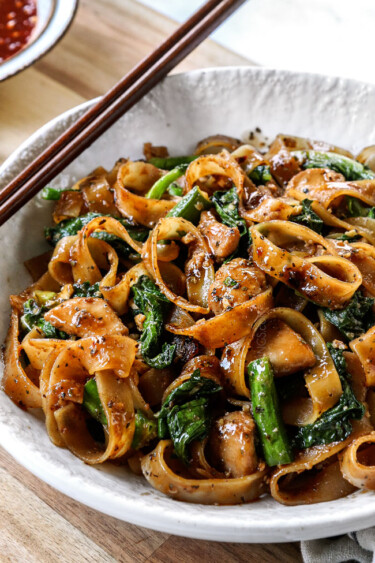
The height and width of the screenshot is (563, 375). I want to click on chopsticks, so click(76, 126), click(80, 145).